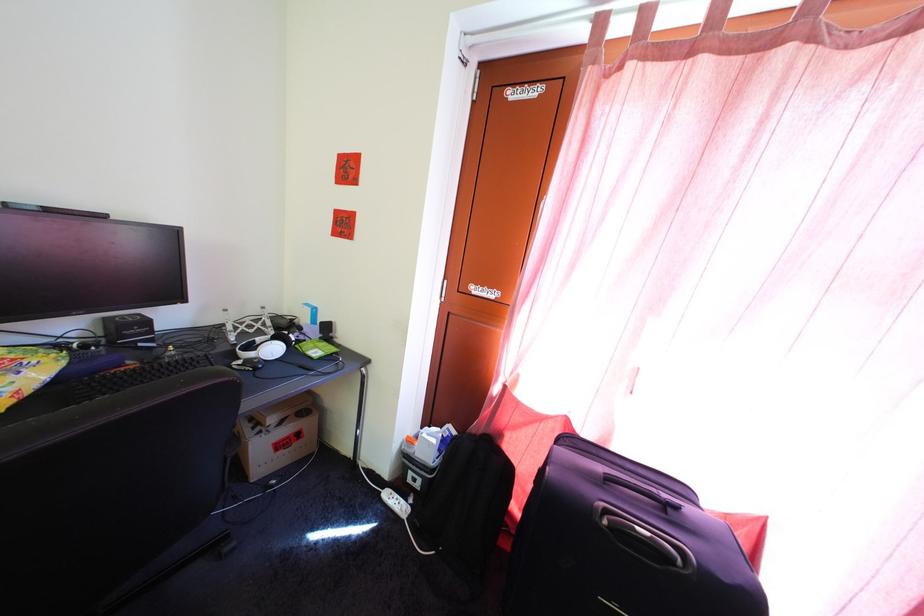
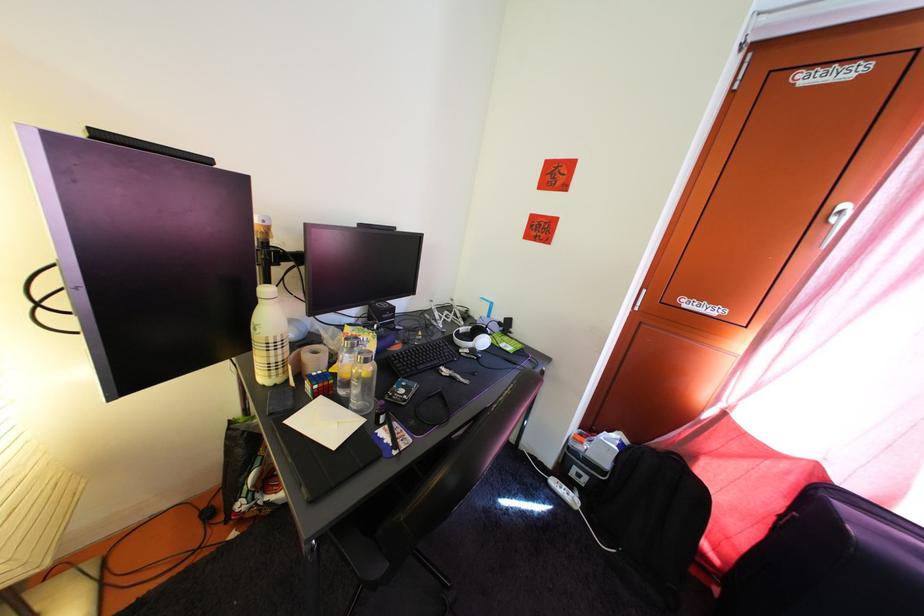
Question: The images are taken continuously from a first-person perspective. In which direction are you moving?

Choices:
 (A) Left
 (B) Right
 (C) Forward
 (D) Backward

Answer: (A)